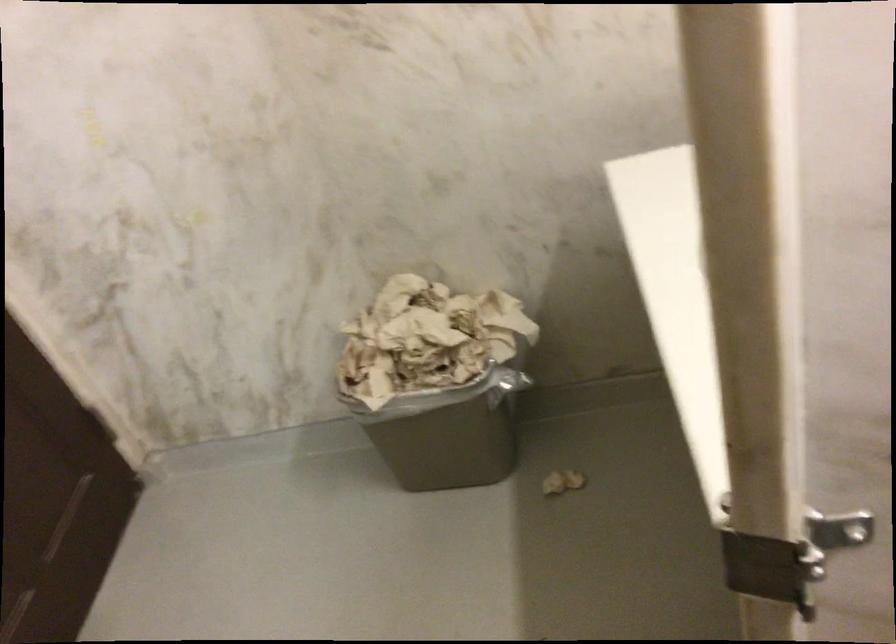
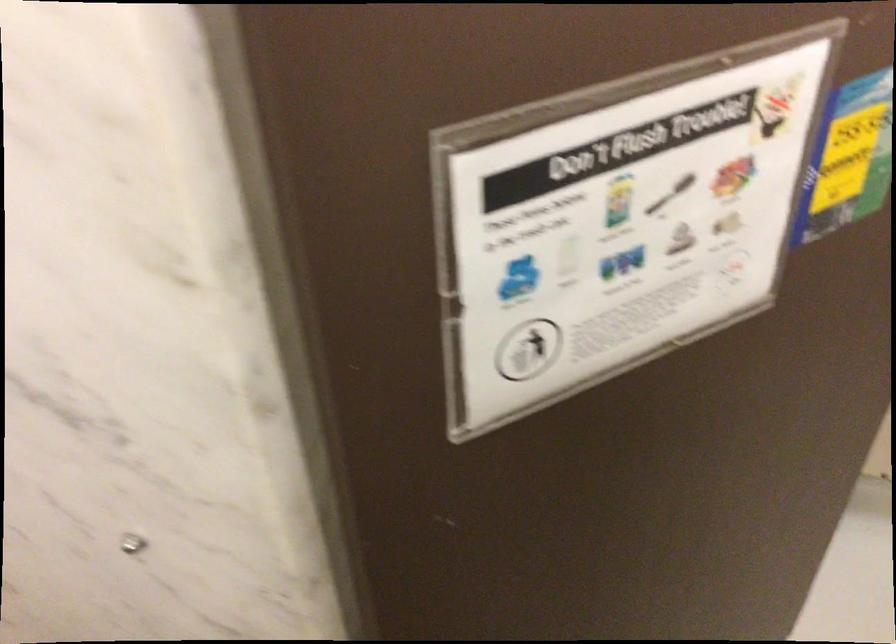
How did the camera likely rotate?

The camera rotated toward left-down.